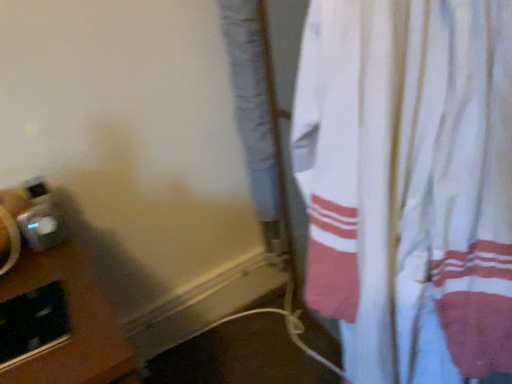
Measure the distance between brown wooden table at lower left and camera.

brown wooden table at lower left and camera are 18.87 inches apart.

The width and height of the screenshot is (512, 384). Describe the element at coordinates (70, 324) in the screenshot. I see `brown wooden table at lower left` at that location.

Where is `brown wooden table at lower left`? brown wooden table at lower left is located at coordinates (70, 324).

This screenshot has width=512, height=384. I want to click on white cotton curtain at right, so click(x=409, y=184).

What do you see at coordinates (409, 184) in the screenshot?
I see `white cotton curtain at right` at bounding box center [409, 184].

Identify the location of brown wooden table at lower left. (70, 324).

Which object is positioned more to the right, brown wooden table at lower left or white cotton curtain at right?

white cotton curtain at right.

Which object is closer to the camera taking this photo, brown wooden table at lower left or white cotton curtain at right?

white cotton curtain at right is in front.

Considering the positions of point (96, 354) and point (471, 368), is point (96, 354) closer or farther from the camera than point (471, 368)?

Point (96, 354) is closer to the camera than point (471, 368).

From the image's perspective, is brown wooden table at lower left above or below white cotton curtain at right?

Based on their image positions, brown wooden table at lower left is located beneath white cotton curtain at right.

From a real-world perspective, is brown wooden table at lower left above or below white cotton curtain at right?

Clearly, from a real-world perspective, brown wooden table at lower left is below white cotton curtain at right.

Which object is thinner, brown wooden table at lower left or white cotton curtain at right?

white cotton curtain at right is thinner.

Who is shorter, brown wooden table at lower left or white cotton curtain at right?

Standing shorter between the two is brown wooden table at lower left.

Is brown wooden table at lower left smaller than white cotton curtain at right?

Actually, brown wooden table at lower left might be larger than white cotton curtain at right.

Can we say brown wooden table at lower left lies outside white cotton curtain at right?

Yes, brown wooden table at lower left is located beyond the bounds of white cotton curtain at right.

Is brown wooden table at lower left with white cotton curtain at right?

No, brown wooden table at lower left is not next to white cotton curtain at right.

Is brown wooden table at lower left oriented towards white cotton curtain at right?

No.

How different are the orientations of brown wooden table at lower left and white cotton curtain at right in degrees?

There is a 90.3-degree angle between the facing directions of brown wooden table at lower left and white cotton curtain at right.

This screenshot has height=384, width=512. In order to click on curtain above the brown wooden table at lower left (from a real-world perspective) in this screenshot , I will do `click(409, 184)`.

Considering the positions of objects white cotton curtain at right and brown wooden table at lower left in the image provided, who is more to the left, white cotton curtain at right or brown wooden table at lower left?

From the viewer's perspective, brown wooden table at lower left appears more on the left side.

Which object is more forward, white cotton curtain at right or brown wooden table at lower left?

white cotton curtain at right.

Is point (481, 31) farther from viewer compared to point (1, 280)?

No, it is not.

From the image's perspective, who appears lower, white cotton curtain at right or brown wooden table at lower left?

brown wooden table at lower left, from the image's perspective.

From a real-world perspective, relative to brown wooden table at lower left, is white cotton curtain at right vertically above or below?

From a real-world perspective, white cotton curtain at right is physically above brown wooden table at lower left.

Which of these two, white cotton curtain at right or brown wooden table at lower left, is thinner?

white cotton curtain at right.

Is white cotton curtain at right shorter than brown wooden table at lower left?

In fact, white cotton curtain at right may be taller than brown wooden table at lower left.

Considering the sizes of objects white cotton curtain at right and brown wooden table at lower left in the image provided, who is bigger, white cotton curtain at right or brown wooden table at lower left?

With larger size is brown wooden table at lower left.

Choose the correct answer: Is white cotton curtain at right inside brown wooden table at lower left or outside it?

white cotton curtain at right is spatially situated outside brown wooden table at lower left.

Is white cotton curtain at right far away from brown wooden table at lower left?

Actually, white cotton curtain at right and brown wooden table at lower left are a little close together.

Does white cotton curtain at right turn towards brown wooden table at lower left?

No.

Consider the image. How much distance is there between white cotton curtain at right and brown wooden table at lower left?

white cotton curtain at right and brown wooden table at lower left are 14.78 inches apart.

Find the location of a particular element. This screenshot has height=384, width=512. table below the white cotton curtain at right (from the image's perspective) is located at coordinates (70, 324).

Where is `table below the white cotton curtain at right (from a real-world perspective)`? The width and height of the screenshot is (512, 384). table below the white cotton curtain at right (from a real-world perspective) is located at coordinates (70, 324).

There is a brown wooden table at lower left. Identify the location of curtain above it (from a real-world perspective). This screenshot has height=384, width=512. (409, 184).